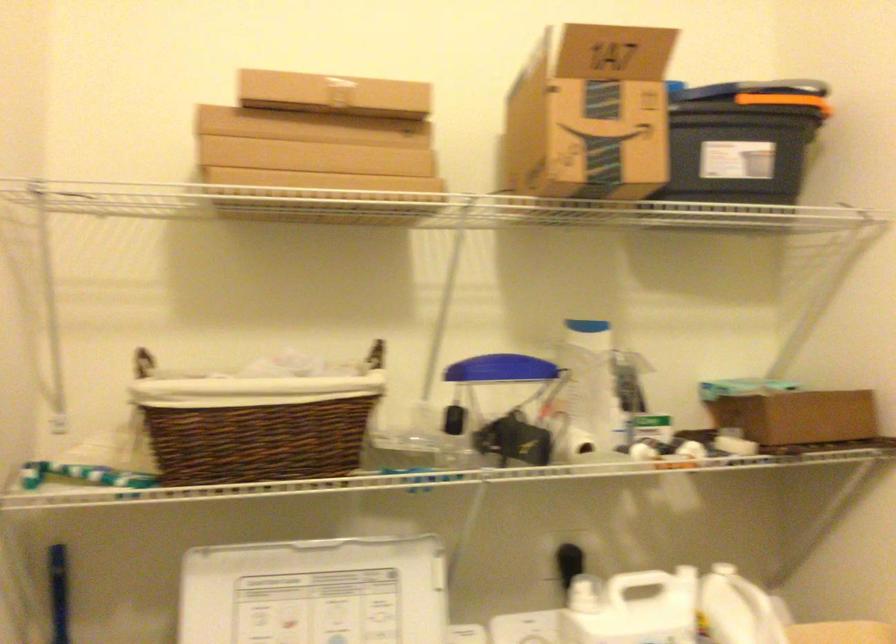
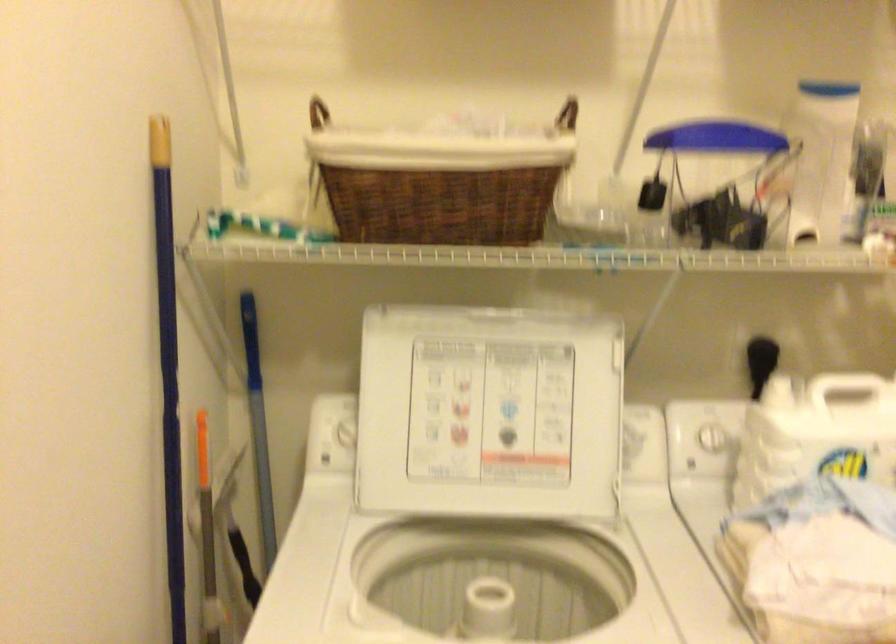
Where in the second image is the point corresponding to (x=564, y=573) from the first image?

(760, 362)